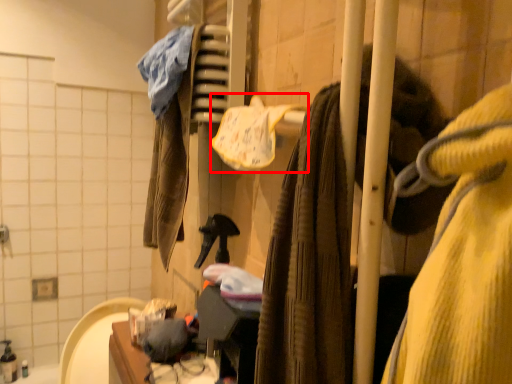
Question: In this image, where is bath towel (annotated by the red box) located relative to closet?

Choices:
 (A) right
 (B) left

Answer: (B)